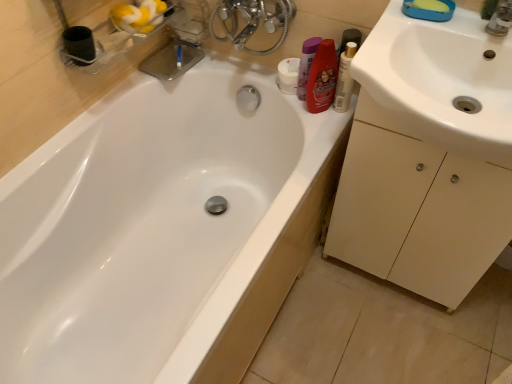
Question: Could you tell me if white glossy bathtub at upper left is facing beige matte cabinet at right?

Choices:
 (A) yes
 (B) no

Answer: (A)

Question: From the image's perspective, would you say white glossy bathtub at upper left is shown under beige matte cabinet at right?

Choices:
 (A) no
 (B) yes

Answer: (B)

Question: Can you confirm if white glossy bathtub at upper left is smaller than beige matte cabinet at right?

Choices:
 (A) no
 (B) yes

Answer: (A)

Question: Would you consider white glossy bathtub at upper left to be distant from beige matte cabinet at right?

Choices:
 (A) no
 (B) yes

Answer: (A)

Question: Is white glossy bathtub at upper left closer to the viewer compared to beige matte cabinet at right?

Choices:
 (A) no
 (B) yes

Answer: (B)

Question: Do you think white glossy sink at right is within white glossy bathtub at upper left, or outside of it?

Choices:
 (A) outside
 (B) inside

Answer: (A)

Question: Considering their positions, is white glossy sink at right located in front of or behind white glossy bathtub at upper left?

Choices:
 (A) front
 (B) behind

Answer: (B)

Question: From a real-world perspective, is white glossy sink at right above or below white glossy bathtub at upper left?

Choices:
 (A) above
 (B) below

Answer: (A)

Question: From their relative heights in the image, would you say white glossy sink at right is taller or shorter than white glossy bathtub at upper left?

Choices:
 (A) short
 (B) tall

Answer: (A)

Question: Considering the positions of white glossy sink at right and white plastic mouthwash at upper right in the image, is white glossy sink at right bigger or smaller than white plastic mouthwash at upper right?

Choices:
 (A) big
 (B) small

Answer: (A)

Question: Considering the positions of point (493, 64) and point (340, 109), is point (493, 64) closer or farther from the camera than point (340, 109)?

Choices:
 (A) closer
 (B) farther

Answer: (A)

Question: Do you think white glossy sink at right is within white plastic mouthwash at upper right, or outside of it?

Choices:
 (A) inside
 (B) outside

Answer: (B)

Question: Is white glossy sink at right wider or thinner than white plastic mouthwash at upper right?

Choices:
 (A) thin
 (B) wide

Answer: (B)

Question: In terms of height, does white glossy bathtub at upper left look taller or shorter compared to white glossy sink at right?

Choices:
 (A) short
 (B) tall

Answer: (B)

Question: Looking at their shapes, would you say white glossy bathtub at upper left is wider or thinner than white glossy sink at right?

Choices:
 (A) wide
 (B) thin

Answer: (A)